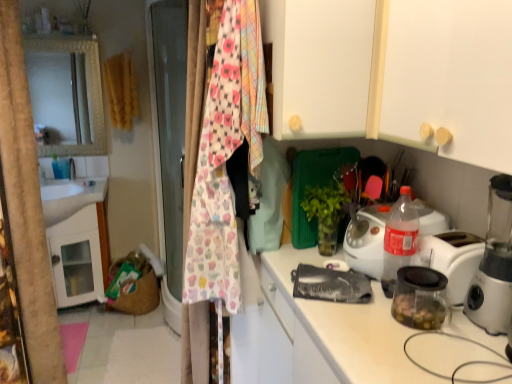
Question: Based on their positions, is white matte cabinet at upper center located to the left or right of transparent glass jar at right?

Choices:
 (A) right
 (B) left

Answer: (B)

Question: Which is correct: white matte cabinet at upper center is inside transparent glass jar at right, or outside of it?

Choices:
 (A) inside
 (B) outside

Answer: (B)

Question: Which of these objects is positioned farthest from the yellow fabric clothesline at upper left, positioned as the first clothesline in back-to-front order?

Choices:
 (A) cupcake-patterned fabric at center, arranged as the first clothesline when viewed from the front
 (B) transparent glass jar at right
 (C) transparent plastic blender at right
 (D) translucent plastic bottle at left
 (E) white glossy sink at left

Answer: (C)

Question: Based on their relative distances, which object is farther from the cupcake-patterned fabric at center, placed as the second clothesline when sorted from back to front?

Choices:
 (A) transparent plastic blender at right
 (B) yellow fabric clothesline at upper left, which is counted as the 2th clothesline, starting from the bottom
 (C) white glossy sink at left
 (D) translucent plastic bottle at left
 (E) white matte cabinet at upper center

Answer: (D)